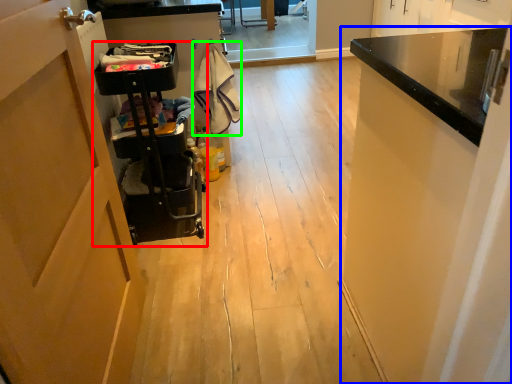
Question: Which object is positioned farthest from trolley (highlighted by a red box)? Select from cabinetry (highlighted by a blue box) and laundry (highlighted by a green box).

Choices:
 (A) cabinetry
 (B) laundry

Answer: (A)